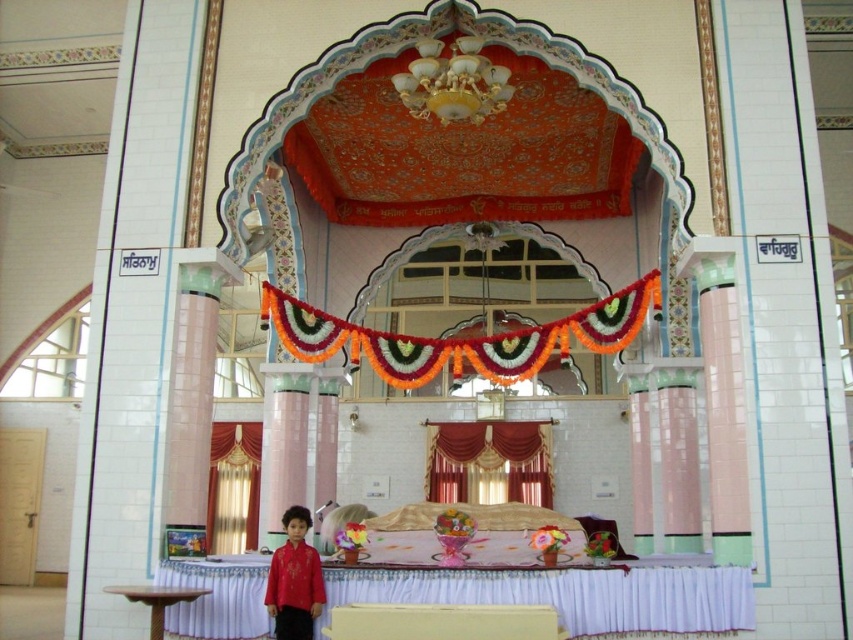
You are standing in the hall and want to move from the gold velvet curtain at lower center to the matte red shirt at lower center. Which direction should you move to reach the shirt?

The gold velvet curtain at lower center is positioned on the left side of the matte red shirt at lower center, so you should move to the right to reach the shirt.

You are an event planner setting up a stage in the hall. You need to hang a banner between the velvet red curtain at center and the gold velvet curtain at lower center. Since the banner requires a higher position, which curtain should you attach it to?

The velvet red curtain at center is located above the gold velvet curtain at lower center, so you should attach the banner to the velvet red curtain at center to ensure it is at a higher position.

You are an event planner setting up for a ceremony. You need to determine which curtain, the velvet red curtain at center or the gold velvet curtain at lower center, has a greater width to decide which one to use as the main backdrop. Based on the scene description, which curtain has a larger width?

The velvet red curtain at center has a larger width than the gold velvet curtain at lower center, so it should be chosen as the main backdrop.